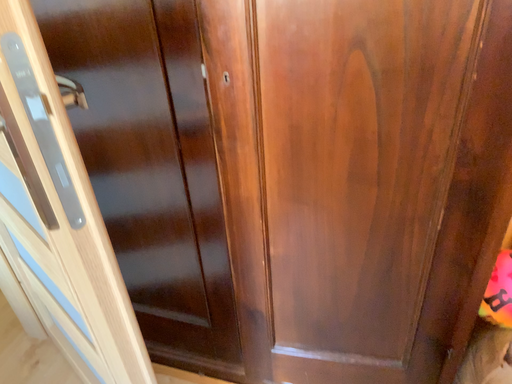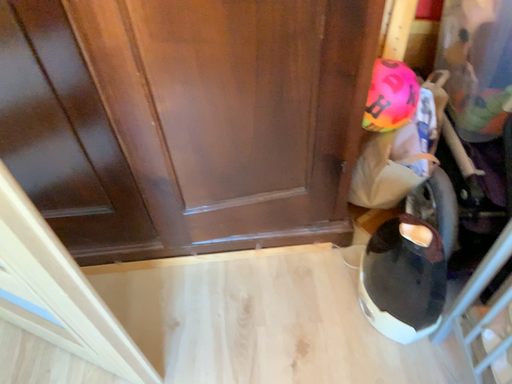
Question: Which way did the camera rotate in the video?

Choices:
 (A) rotated left
 (B) rotated right

Answer: (B)